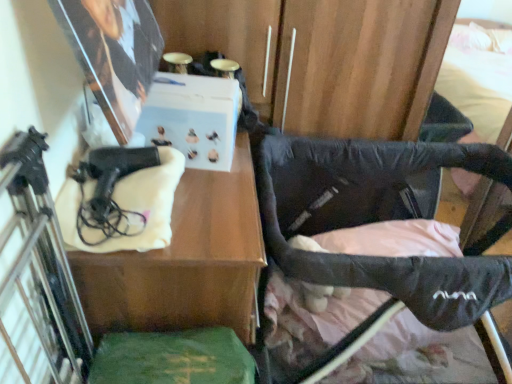
Question: In terms of width, does matte black hairdryer at left look wider or thinner when compared to green felt book at lower center?

Choices:
 (A) wide
 (B) thin

Answer: (A)

Question: From a real-world perspective, is matte black hairdryer at left positioned above or below green felt book at lower center?

Choices:
 (A) above
 (B) below

Answer: (B)

Question: Which object is positioned closest to the black fabric stroller at lower right?

Choices:
 (A) black matte gun at left
 (B) green felt book at lower center
 (C) matte black hairdryer at left

Answer: (C)

Question: Which of these objects is positioned closest to the black fabric stroller at lower right?

Choices:
 (A) green felt book at lower center
 (B) black matte gun at left
 (C) matte black hairdryer at left

Answer: (C)